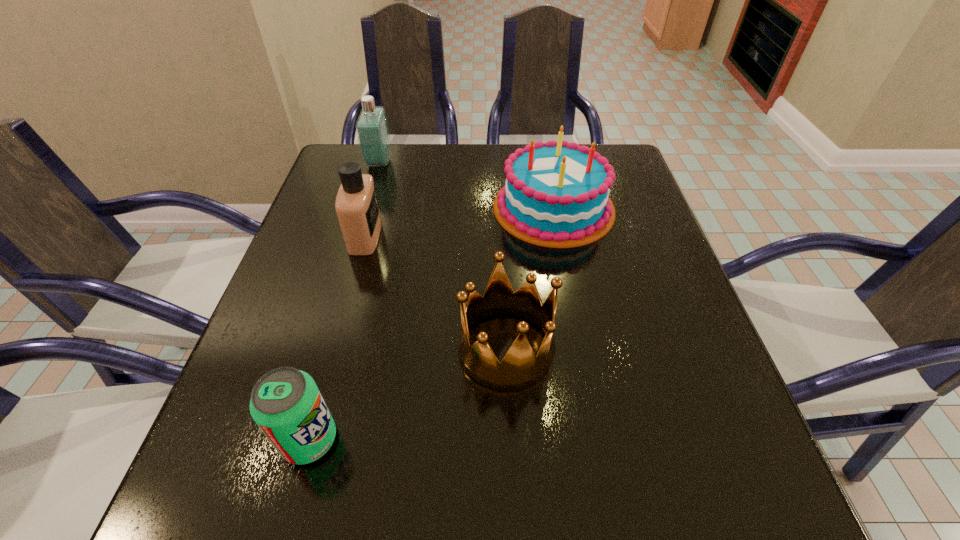
In the image, there is a desktop. Find the location of `vacant area at the left edge`. vacant area at the left edge is located at coordinates (258, 448).

I want to click on vacant space at the right edge of the desktop, so click(623, 230).

Where is `vacant space at the far right corner of the desktop`? The height and width of the screenshot is (540, 960). vacant space at the far right corner of the desktop is located at coordinates point(633,171).

Locate an element on the screen. Image resolution: width=960 pixels, height=540 pixels. free space between the birthday cake and the pop soda is located at coordinates (431, 324).

Image resolution: width=960 pixels, height=540 pixels. I want to click on free area in between the crown and the nearer perfume, so click(x=436, y=292).

I want to click on vacant region between the nearest object and the birthday cake, so click(431, 324).

Identify the location of vacant area that lies between the nearer perfume and the crown. This screenshot has height=540, width=960. (436, 292).

Where is `free point between the nearer perfume and the crown`? free point between the nearer perfume and the crown is located at coordinates (436, 292).

At what (x,y) coordinates should I click in order to perform the action: click on vacant space in between the crown and the pop soda. Please return your answer as a coordinate pair (x, y). Looking at the image, I should click on (408, 394).

The width and height of the screenshot is (960, 540). Find the location of `unoccupied position between the crown and the nearest object`. unoccupied position between the crown and the nearest object is located at coordinates pos(408,394).